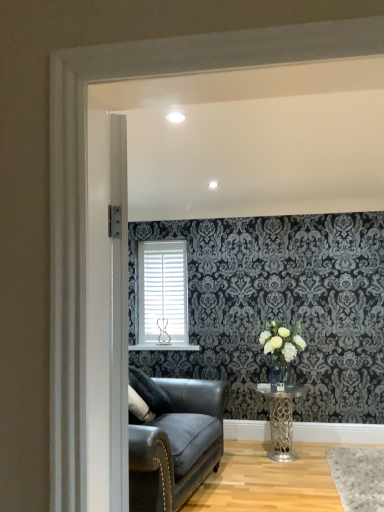
What is the approximate width of metallic silver table at lower center?

19.72 inches.

What is the approximate width of clear glass vase at center?

It is 12.57 centimeters.

You are a GUI agent. You are given a task and a screenshot of the screen. Output one action in this format:
    pyautogui.click(x=<x>, y=<y>)
    Task: Click on the clear glass vase at center
    
    Given the screenshot: What is the action you would take?
    pyautogui.click(x=277, y=378)

Image resolution: width=384 pixels, height=512 pixels. I want to click on white matte vase at center-right, so click(281, 341).

The height and width of the screenshot is (512, 384). Find the location of `metallic silver table at lower center`. metallic silver table at lower center is located at coordinates (281, 418).

What's the angular difference between clear glass vase at center and white matte vase at center-right's facing directions?

The angle between the facing direction of clear glass vase at center and the facing direction of white matte vase at center-right is 1.71 degrees.

Does clear glass vase at center have a greater width compared to white matte vase at center-right?

No, clear glass vase at center is not wider than white matte vase at center-right.

Measure the distance from clear glass vase at center to white matte vase at center-right.

clear glass vase at center and white matte vase at center-right are 12.68 inches apart from each other.

Considering the sizes of objects clear glass vase at center and white matte vase at center-right in the image provided, who is shorter, clear glass vase at center or white matte vase at center-right?

clear glass vase at center is shorter.

From the picture: Does white matte blinds at center come in front of white matte vase at center-right?

No, white matte blinds at center is behind white matte vase at center-right.

Is white matte vase at center-right surrounded by white matte blinds at center?

No.

Locate an element on the screen. Image resolution: width=384 pixels, height=512 pixels. flower in front of the white matte blinds at center is located at coordinates (281, 341).

From a real-world perspective, does white matte blinds at center sit lower than white matte vase at center-right?

Actually, white matte blinds at center is physically above white matte vase at center-right in the real world.

From a real-world perspective, is white matte vase at center-right on top of white matte blinds at center?

No, from a real-world perspective, white matte vase at center-right is not on top of white matte blinds at center.

Is white matte vase at center-right behind white matte blinds at center?

No, it is in front of white matte blinds at center.

What's the angular difference between white matte vase at center-right and white matte blinds at center's facing directions?

white matte vase at center-right and white matte blinds at center are facing 0.0735 degrees away from each other.

Locate an element on the screen. This screenshot has height=512, width=384. blind that is behind the white matte vase at center-right is located at coordinates [164, 291].

Is metallic silver table at lower center in front of or behind white matte blinds at center in the image?

metallic silver table at lower center is in front of white matte blinds at center.

From their relative heights in the image, would you say metallic silver table at lower center is taller or shorter than white matte blinds at center?

Considering their sizes, metallic silver table at lower center has less height than white matte blinds at center.

Which point is more distant from viewer, (275, 458) or (175, 303)?

The point (175, 303) is more distant.

Based on the photo, is metallic silver table at lower center turned away from white matte blinds at center?

No, metallic silver table at lower center is not facing the opposite direction of white matte blinds at center.

Where is `flower lying above the metallic silver table at lower center (from the image's perspective)`? flower lying above the metallic silver table at lower center (from the image's perspective) is located at coordinates (281, 341).

Which object is more forward, metallic silver table at lower center or white matte vase at center-right?

metallic silver table at lower center is closer to the camera.

Does metallic silver table at lower center have a smaller size compared to white matte vase at center-right?

Incorrect, metallic silver table at lower center is not smaller in size than white matte vase at center-right.

Can white matte blinds at center be found inside clear glass vase at center?

Actually, white matte blinds at center is outside clear glass vase at center.

Which of these two, clear glass vase at center or white matte blinds at center, stands shorter?

clear glass vase at center.

Is clear glass vase at center oriented away from white matte blinds at center?

clear glass vase at center is not turned away from white matte blinds at center.

Is the depth of clear glass vase at center less than that of white matte blinds at center?

Yes, clear glass vase at center is closer to the camera.

Locate an element on the screen. The height and width of the screenshot is (512, 384). blind behind the clear glass vase at center is located at coordinates (164, 291).

Are white matte blinds at center and clear glass vase at center beside each other?

No, white matte blinds at center is not with clear glass vase at center.

Considering the relative sizes of white matte blinds at center and clear glass vase at center in the image provided, is white matte blinds at center thinner than clear glass vase at center?

Correct, the width of white matte blinds at center is less than that of clear glass vase at center.

Looking at this image, does white matte blinds at center turn towards clear glass vase at center?

No.

Where is `glass vase that appears on the left of white matte vase at center-right`? The width and height of the screenshot is (384, 512). glass vase that appears on the left of white matte vase at center-right is located at coordinates (277, 378).

Where is `blind above the white matte vase at center-right (from the image's perspective)`? blind above the white matte vase at center-right (from the image's perspective) is located at coordinates (164, 291).

Considering their positions, is metallic silver table at lower center positioned further to clear glass vase at center than white matte blinds at center?

white matte blinds at center is positioned further to the anchor clear glass vase at center.

Based on the photo, from the image, which object appears to be nearer to clear glass vase at center, white matte blinds at center or white matte vase at center-right?

Among the two, white matte vase at center-right is located nearer to clear glass vase at center.

Looking at the image, which one is located further to metallic silver table at lower center, white matte vase at center-right or white matte blinds at center?

white matte blinds at center is positioned further to the anchor metallic silver table at lower center.

Based on their spatial positions, is clear glass vase at center or metallic silver table at lower center closer to white matte blinds at center?

metallic silver table at lower center is closer to white matte blinds at center.

Looking at the image, which one is located closer to clear glass vase at center, white matte vase at center-right or white matte blinds at center?

white matte vase at center-right lies closer to clear glass vase at center than the other object.

Which object lies nearer to the anchor point white matte blinds at center, white matte vase at center-right or metallic silver table at lower center?

white matte vase at center-right is positioned closer to the anchor white matte blinds at center.

From the image, which object appears to be farther from white matte vase at center-right, white matte blinds at center or metallic silver table at lower center?

Based on the image, white matte blinds at center appears to be further to white matte vase at center-right.

Looking at the image, which one is located closer to white matte vase at center-right, metallic silver table at lower center or clear glass vase at center?

clear glass vase at center lies closer to white matte vase at center-right than the other object.

In order to click on glass vase between white matte blinds at center and metallic silver table at lower center in the horizontal direction in this screenshot , I will do `click(277, 378)`.

Identify the location of glass vase situated between white matte blinds at center and white matte vase at center-right from left to right. This screenshot has height=512, width=384. (277, 378).

You are a GUI agent. You are given a task and a screenshot of the screen. Output one action in this format:
    pyautogui.click(x=<x>, y=<y>)
    Task: Click on the table between white matte blinds at center and white matte vase at center-right from left to right
    
    Given the screenshot: What is the action you would take?
    pyautogui.click(x=281, y=418)

This screenshot has height=512, width=384. I want to click on glass vase between white matte vase at center-right and metallic silver table at lower center from top to bottom, so click(277, 378).